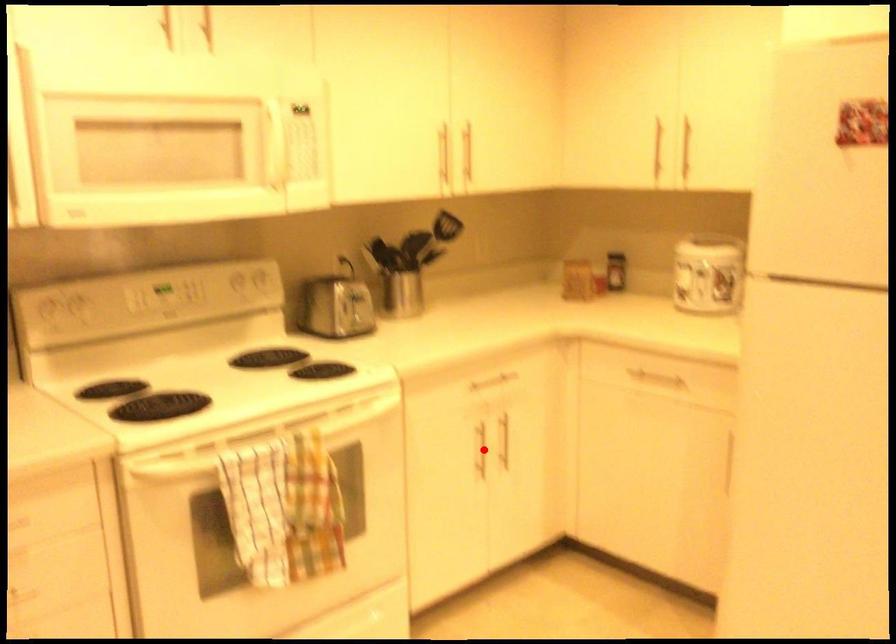
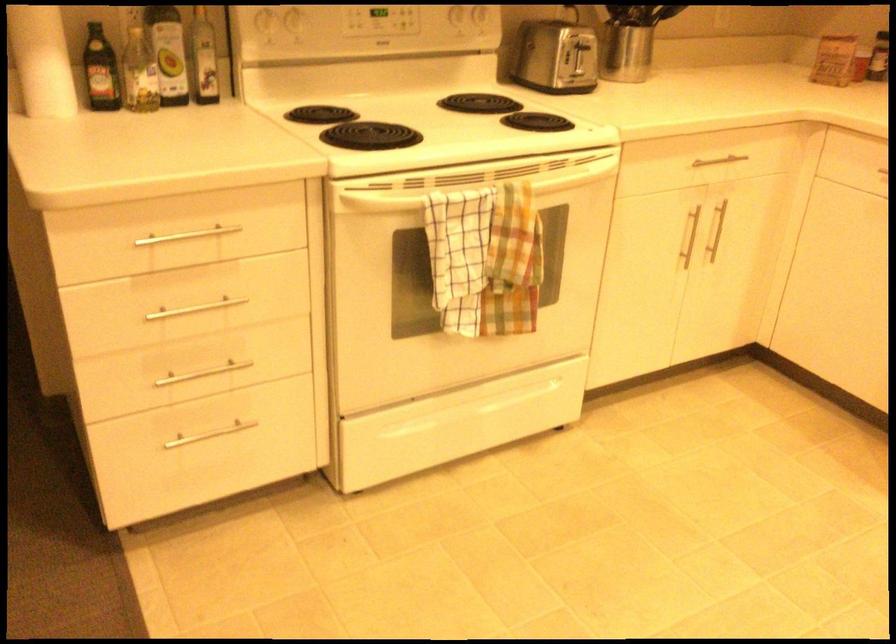
Locate, in the second image, the point that corresponds to the highlighted location in the first image.

(687, 237)